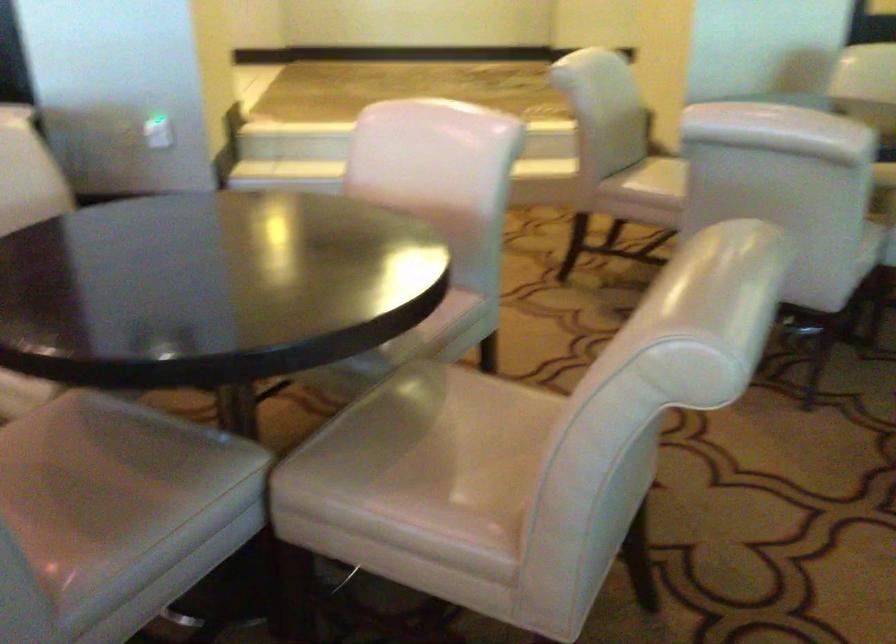
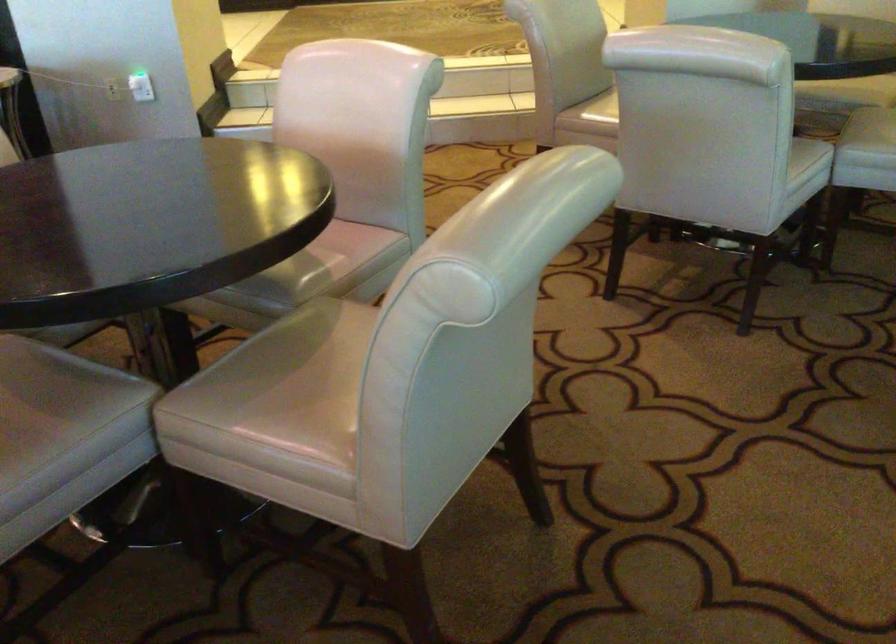
Question: Based on the continuous images, in which direction is the camera rotating? Reply with the corresponding letter.

Choices:
 (A) Left
 (B) Right
 (C) Up
 (D) Down

Answer: (D)